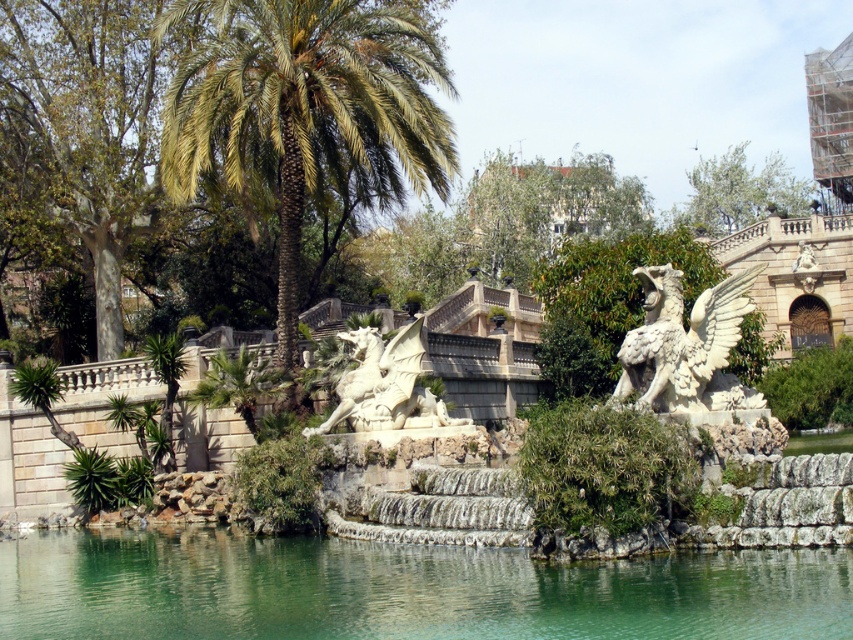
Is green leafy palm at center bigger than white stone dragon at center?

Yes, green leafy palm at center is bigger than white stone dragon at center.

Between point (402, 157) and point (392, 385), which one is positioned in front?

Point (392, 385) is more forward.

Identify the location of green leafy palm at center. The image size is (853, 640). (306, 109).

Is point (477, 556) farther from viewer compared to point (743, 394)?

No, it is in front of (743, 394).

Between point (175, 618) and point (642, 384), which one is positioned in front?

Point (175, 618) is more forward.

The width and height of the screenshot is (853, 640). What are the coordinates of `green stone water at center` in the screenshot? It's located at (403, 589).

Is point (415, 90) closer to camera compared to point (653, 332)?

That is False.

Is point (259, 10) positioned after point (718, 385)?

Yes, point (259, 10) is farther from viewer.

Who is more forward, (402, 145) or (676, 410)?

Point (676, 410) is in front.

This screenshot has height=640, width=853. I want to click on green leafy palm at center, so click(x=306, y=109).